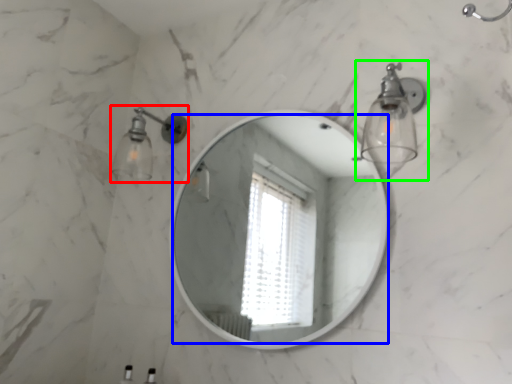
Question: Which object is positioned closest to light fixture (highlighted by a red box)? Select from mirror (highlighted by a blue box) and light fixture (highlighted by a green box).

Choices:
 (A) mirror
 (B) light fixture

Answer: (B)